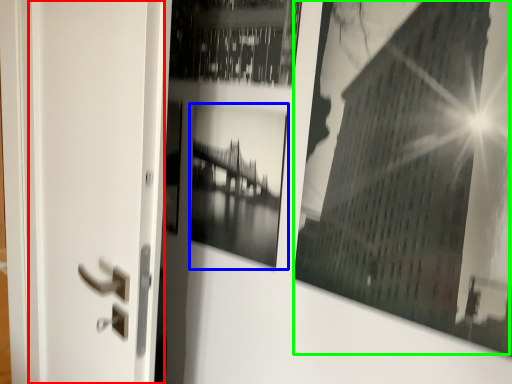
Question: Considering the real-world distances, which object is closest to screen door (highlighted by a red box)? picture frame (highlighted by a blue box) or picture frame (highlighted by a green box).

Choices:
 (A) picture frame
 (B) picture frame

Answer: (A)